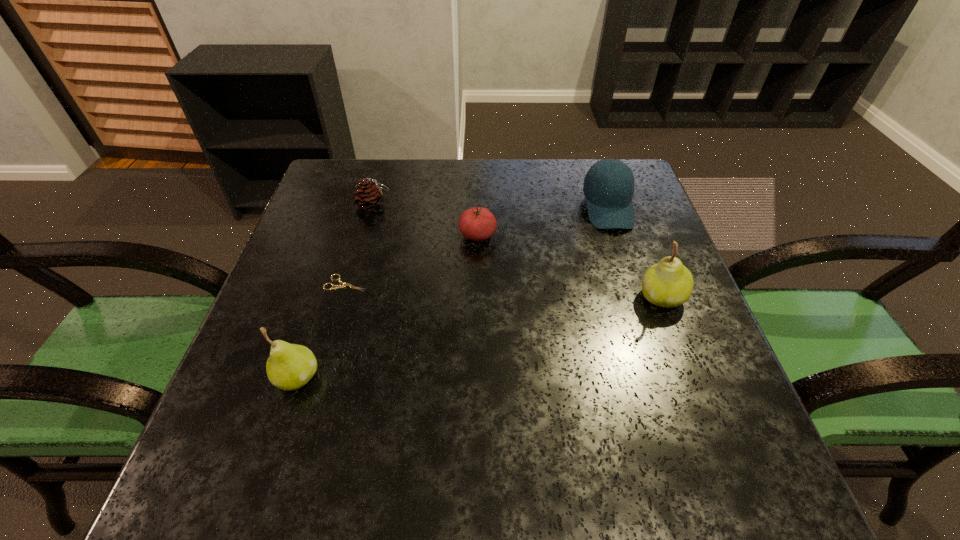
To achieve even spacing by inserting another pear among them, please point to a vacant spot for this new pear. Please provide its 2D coordinates. Your answer should be formatted as a tuple, i.e. [(x, y)], where the tuple contains the x and y coordinates of a point satisfying the conditions above.

[(493, 334)]